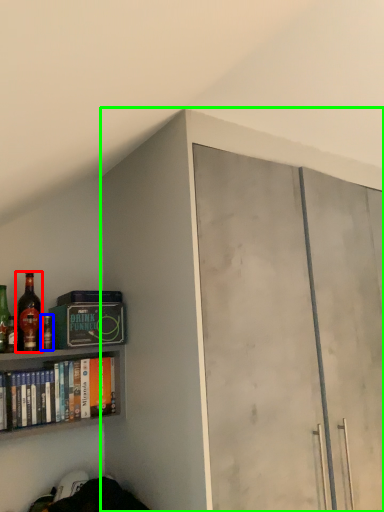
Question: Based on their relative distances, which object is nearer to bottle (highlighted by a red box)? Choose from bottle (highlighted by a blue box) and cabinetry (highlighted by a green box).

Choices:
 (A) bottle
 (B) cabinetry

Answer: (A)